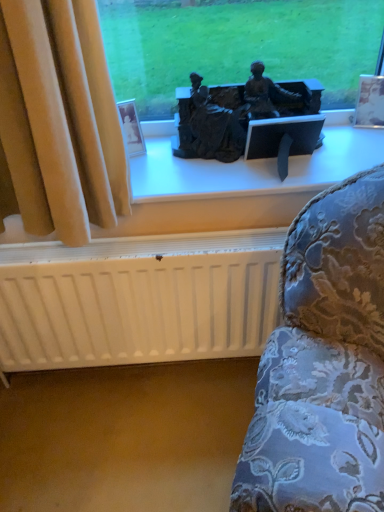
Question: Is matte black statue at center further to the viewer compared to white matte radiator at lower center?

Choices:
 (A) yes
 (B) no

Answer: (A)

Question: Is matte black statue at center to the left of white matte radiator at lower center from the viewer's perspective?

Choices:
 (A) yes
 (B) no

Answer: (B)

Question: From a real-world perspective, is matte black statue at center physically below white matte radiator at lower center?

Choices:
 (A) no
 (B) yes

Answer: (A)

Question: From the image's perspective, is matte black statue at center over white matte radiator at lower center?

Choices:
 (A) yes
 (B) no

Answer: (A)

Question: Can you confirm if matte black statue at center is thinner than white matte radiator at lower center?

Choices:
 (A) yes
 (B) no

Answer: (B)

Question: Considering the positions of white matte radiator at lower center and bronze statue at center in the image, is white matte radiator at lower center wider or thinner than bronze statue at center?

Choices:
 (A) wide
 (B) thin

Answer: (B)

Question: Does point (105, 278) appear closer or farther from the camera than point (304, 91)?

Choices:
 (A) farther
 (B) closer

Answer: (B)

Question: Considering their positions, is white matte radiator at lower center located in front of or behind bronze statue at center?

Choices:
 (A) behind
 (B) front

Answer: (A)

Question: Choose the correct answer: Is white matte radiator at lower center inside bronze statue at center or outside it?

Choices:
 (A) outside
 (B) inside

Answer: (A)

Question: Is point [220, 133] positioned closer to the camera than point [158, 189]?

Choices:
 (A) farther
 (B) closer

Answer: (A)

Question: In terms of height, does bronze statue at center look taller or shorter compared to matte black statue at center?

Choices:
 (A) tall
 (B) short

Answer: (A)

Question: Is bronze statue at center to the left or to the right of matte black statue at center in the image?

Choices:
 (A) right
 (B) left

Answer: (A)

Question: In terms of size, does bronze statue at center appear bigger or smaller than matte black statue at center?

Choices:
 (A) big
 (B) small

Answer: (B)

Question: Looking at the image, does bronze statue at center seem bigger or smaller compared to white matte radiator at lower center?

Choices:
 (A) big
 (B) small

Answer: (B)

Question: From a real-world perspective, relative to white matte radiator at lower center, is bronze statue at center vertically above or below?

Choices:
 (A) below
 (B) above

Answer: (B)